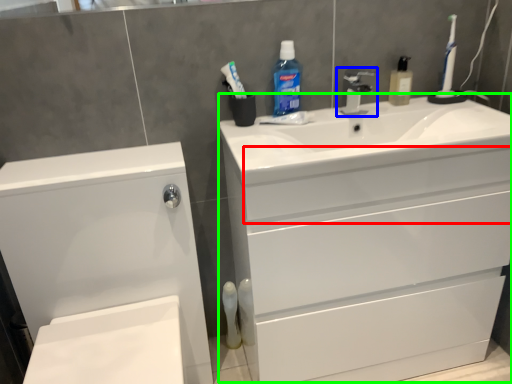
Question: Estimate the real-world distances between objects in this image. Which object is closer to drawer (highlighted by a red box), tap (highlighted by a blue box) or counter top (highlighted by a green box)?

Choices:
 (A) tap
 (B) counter top

Answer: (B)